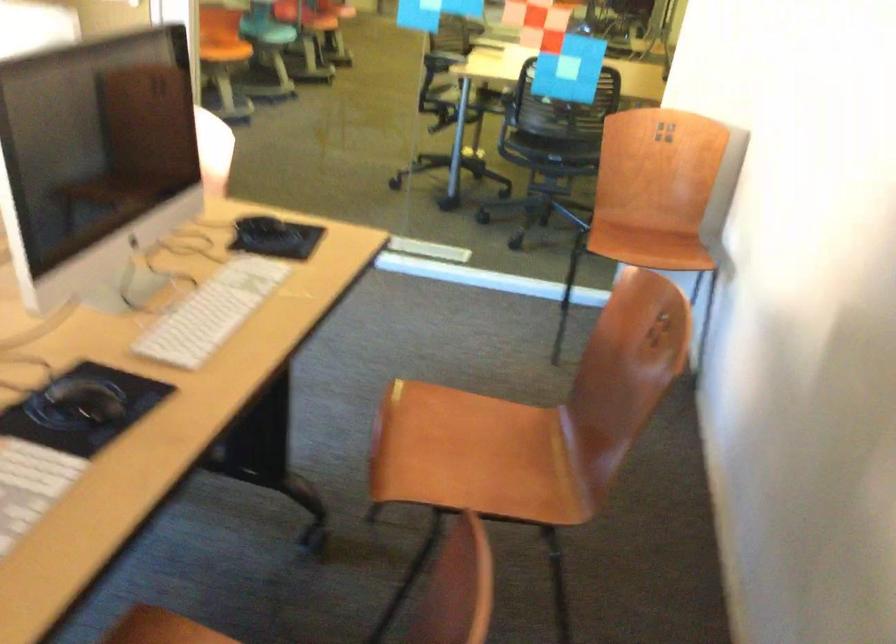
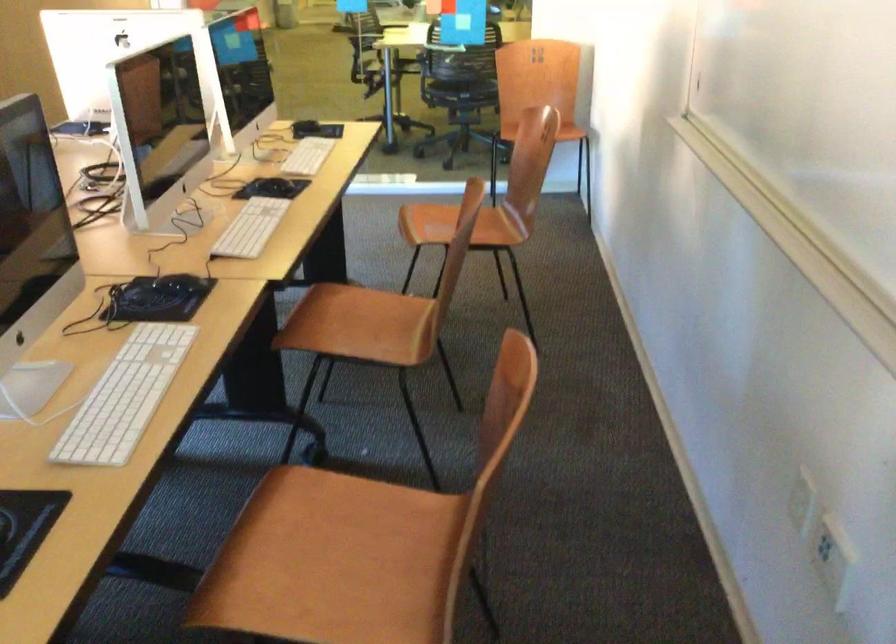
Question: In a continuous first-person perspective shot, in which direction is the camera moving?

Choices:
 (A) Left
 (B) Right
 (C) Forward
 (D) Backward

Answer: (D)